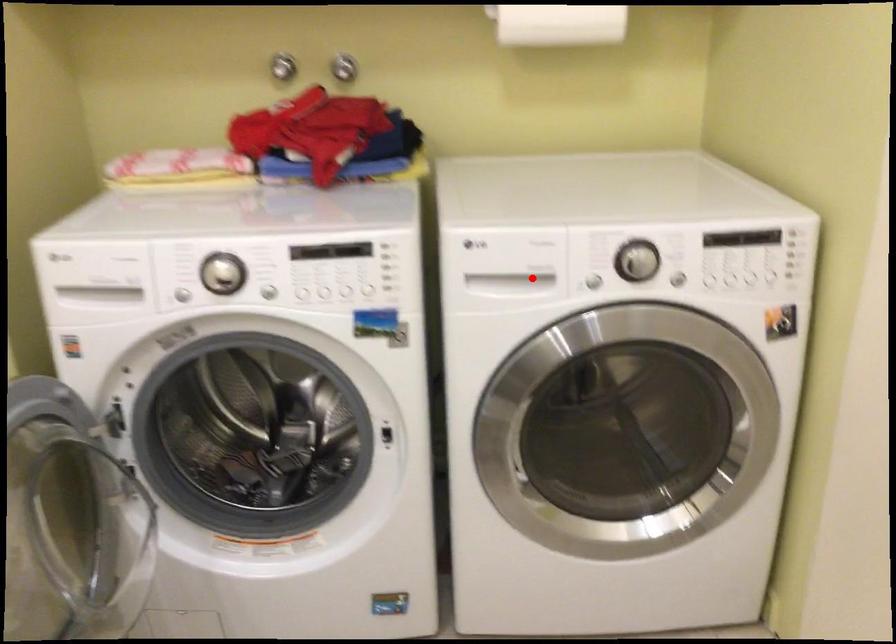
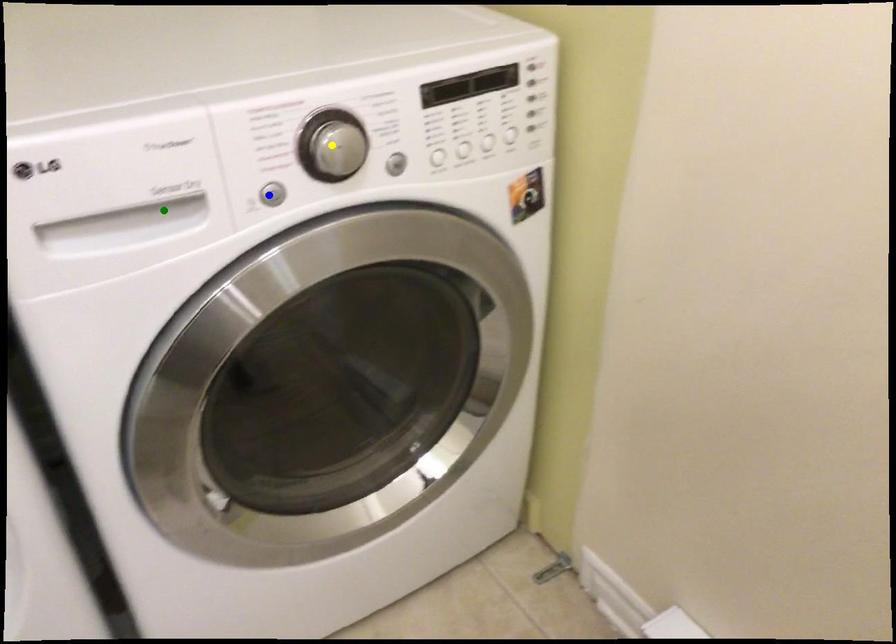
Question: I am providing you with two images of the same scene from different viewpoints. A red point is marked on the first image. You are given multiple points on the second image. Which mark in image 2 goes with the point in image 1?

Choices:
 (A) green point
 (B) blue point
 (C) yellow point

Answer: (A)